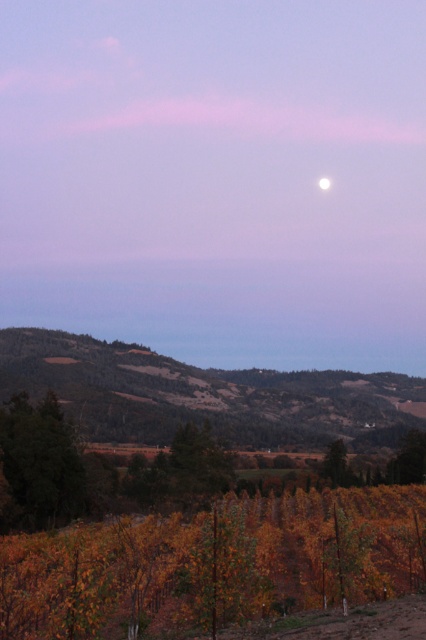
Question: Does green grassy hillside at lower center appear on the left side of bright white sphere at upper center?

Choices:
 (A) yes
 (B) no

Answer: (A)

Question: Which point is farther to the camera?

Choices:
 (A) click(x=336, y=451)
 (B) click(x=322, y=182)

Answer: (B)

Question: Does green matte tree at lower left appear on the left side of green matte tree at center?

Choices:
 (A) yes
 (B) no

Answer: (A)

Question: Can you confirm if green grassy hillside at lower center is bigger than green matte tree at lower left?

Choices:
 (A) yes
 (B) no

Answer: (A)

Question: Which point is farther from the camera taking this photo?

Choices:
 (A) (347, 420)
 (B) (331, 442)

Answer: (A)

Question: Which point is farther to the camera?

Choices:
 (A) green matte tree at center
 (B) green matte tree at lower left

Answer: (A)